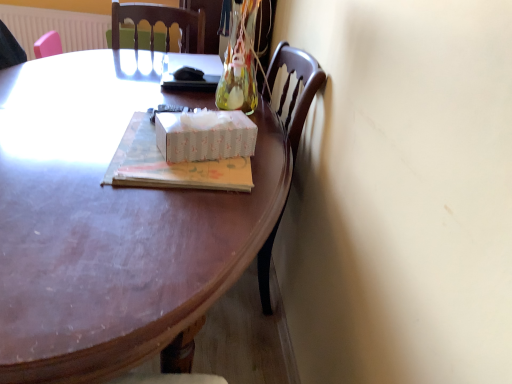
I want to click on vacant area on top of wooden desk at center (from a real-world perspective), so click(100, 131).